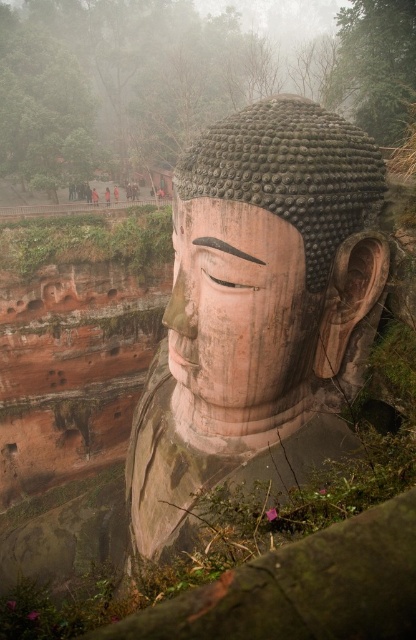
Question: Which point is farther to the camera?

Choices:
 (A) smooth stone head at center
 (B) smooth stone face at center

Answer: (B)

Question: Is smooth stone head at center to the right of smooth stone face at center from the viewer's perspective?

Choices:
 (A) no
 (B) yes

Answer: (B)

Question: Among these points, which one is nearest to the camera?

Choices:
 (A) (364, 252)
 (B) (212, 291)

Answer: (B)

Question: Can you confirm if smooth stone head at center is positioned to the right of smooth stone face at center?

Choices:
 (A) yes
 (B) no

Answer: (A)

Question: Does smooth stone head at center appear under smooth stone face at center?

Choices:
 (A) yes
 (B) no

Answer: (B)

Question: Which object is closer to the camera taking this photo?

Choices:
 (A) smooth stone head at center
 (B) smooth stone face at center

Answer: (A)